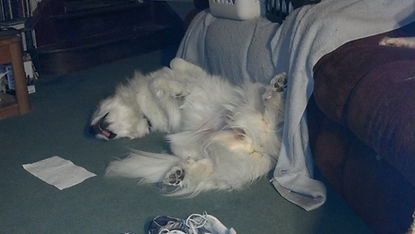
Find the location of a particular element. The height and width of the screenshot is (234, 415). end table is located at coordinates (14, 54).